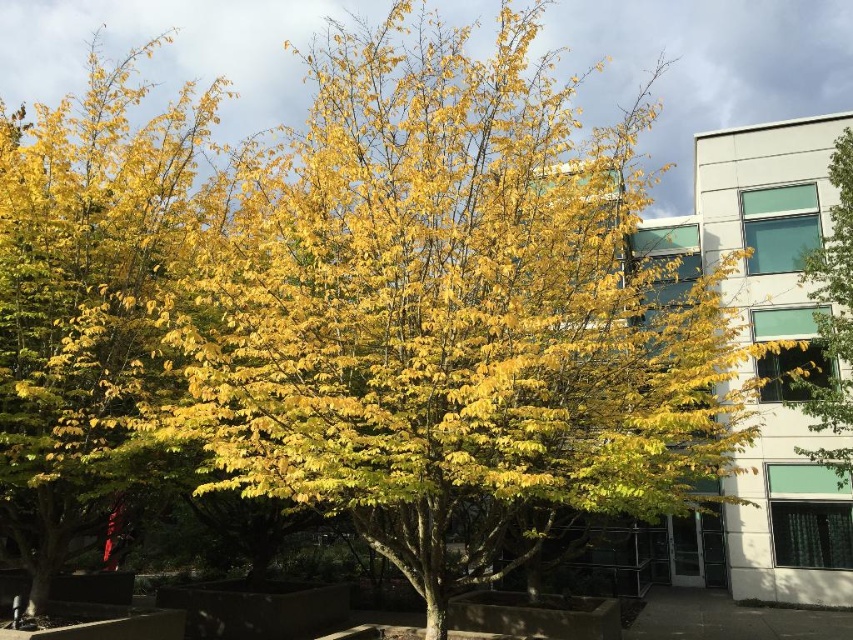
Consider the image. You are standing in front of the autumn tree scene. There are two points marked in the image, one at coordinates point (20, 413) and another at point (839, 358). Which point is nearer to you?

Point (20, 413) is closer to the viewer than point (839, 358).